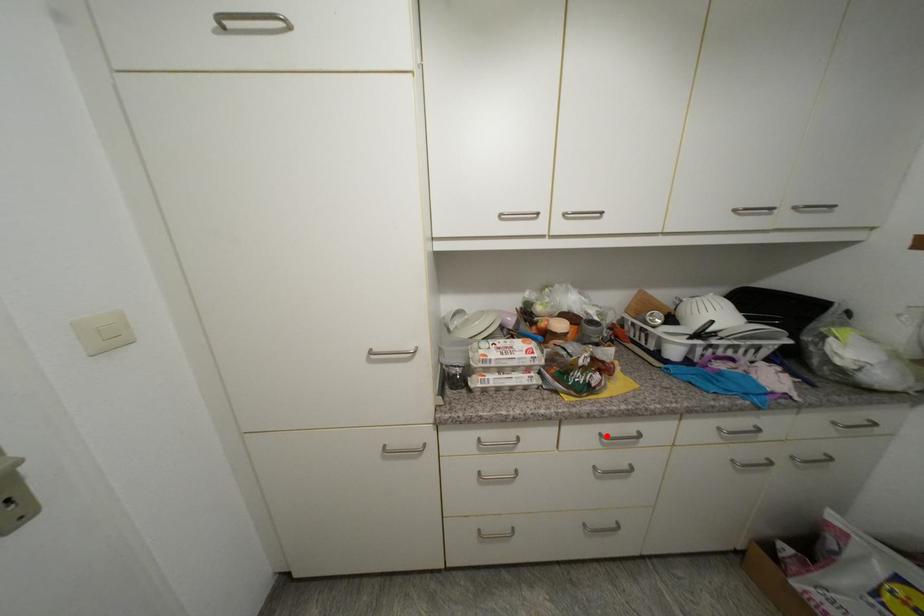
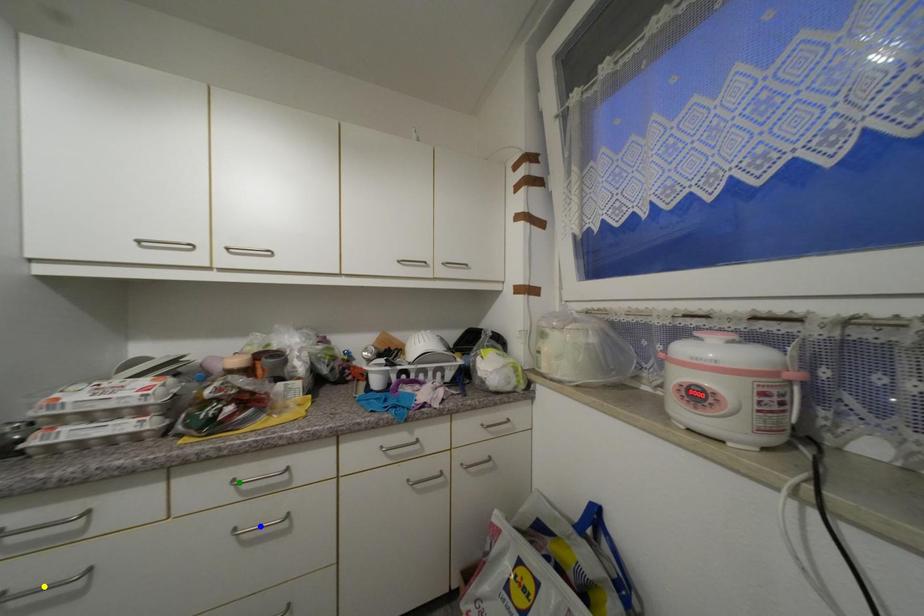
Question: I am providing you with two images of the same scene from different viewpoints. A red point is marked on the first image. You are given multiple points on the second image. Which point in image 2 represents the same 3d spot as the red point in image 1?

Choices:
 (A) blue point
 (B) green point
 (C) yellow point

Answer: (B)